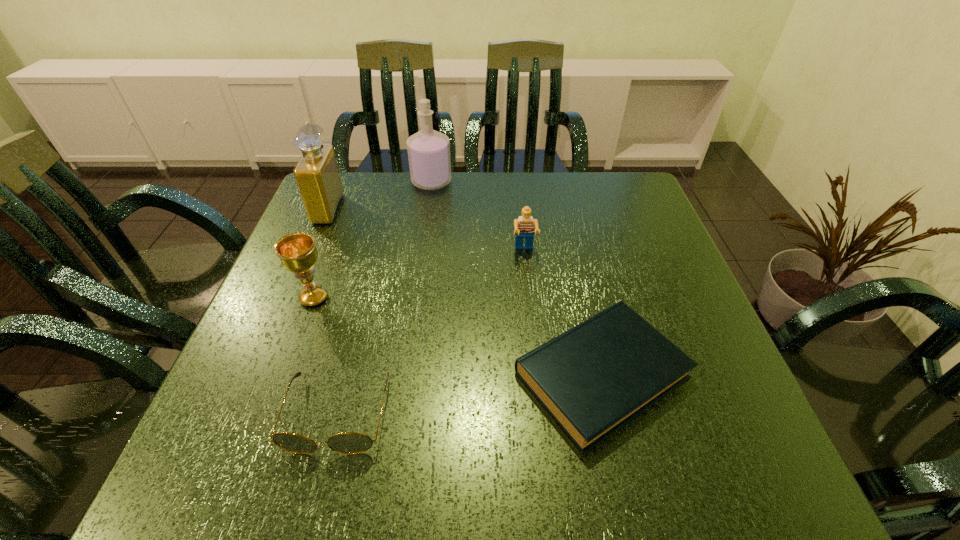
Identify the location of vacant area situated 0.050m on the front of the right perfume. (428, 203).

Identify the location of vacant space located 0.310m on the front-facing side of the second farthest object. (457, 210).

Where is `vacant space situated on the right of the chalice`? Image resolution: width=960 pixels, height=540 pixels. vacant space situated on the right of the chalice is located at coordinates (379, 298).

Locate an element on the screen. The image size is (960, 540). vacant point located 0.360m on the face of the fourth nearest object is located at coordinates (540, 395).

The width and height of the screenshot is (960, 540). Identify the location of vacant region located 0.050m on the right of the shortest object. (717, 375).

Identify the location of sunglasses that is at the near edge. The width and height of the screenshot is (960, 540). (348, 442).

I want to click on book present at the near edge, so click(x=593, y=379).

The width and height of the screenshot is (960, 540). Find the location of `perfume located at the left edge`. perfume located at the left edge is located at coordinates (317, 175).

You are a GUI agent. You are given a task and a screenshot of the screen. Output one action in this format:
    pyautogui.click(x=<x>, y=<y>)
    Task: Click on the chalice located at the left edge
    
    Given the screenshot: What is the action you would take?
    pyautogui.click(x=297, y=252)

At what (x,y) coordinates should I click in order to perform the action: click on sunglasses that is at the left edge. Please return your answer as a coordinate pair (x, y). Looking at the image, I should click on (348, 442).